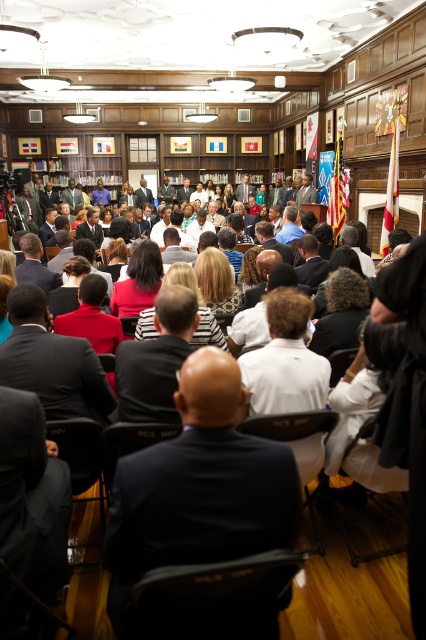
Question: Does dark blue suit at center appear on the right side of matte black jacket at center?

Choices:
 (A) yes
 (B) no

Answer: (A)

Question: Does matte red dress at center lie behind matte black jacket at center?

Choices:
 (A) no
 (B) yes

Answer: (A)

Question: Which point is closer to the camera?

Choices:
 (A) dark blue suit at center
 (B) matte black jacket at center

Answer: (A)

Question: Estimate the real-world distances between objects in this image. Which object is farther from the matte red dress at center?

Choices:
 (A) black suit at center
 (B) dark blue suit at center
 (C) matte black jacket at center

Answer: (B)

Question: Does dark blue suit at center have a larger size compared to black suit at center?

Choices:
 (A) no
 (B) yes

Answer: (A)

Question: Which of the following is the closest to the observer?

Choices:
 (A) (250, 531)
 (B) (88, 336)
 (C) (178, 339)

Answer: (A)